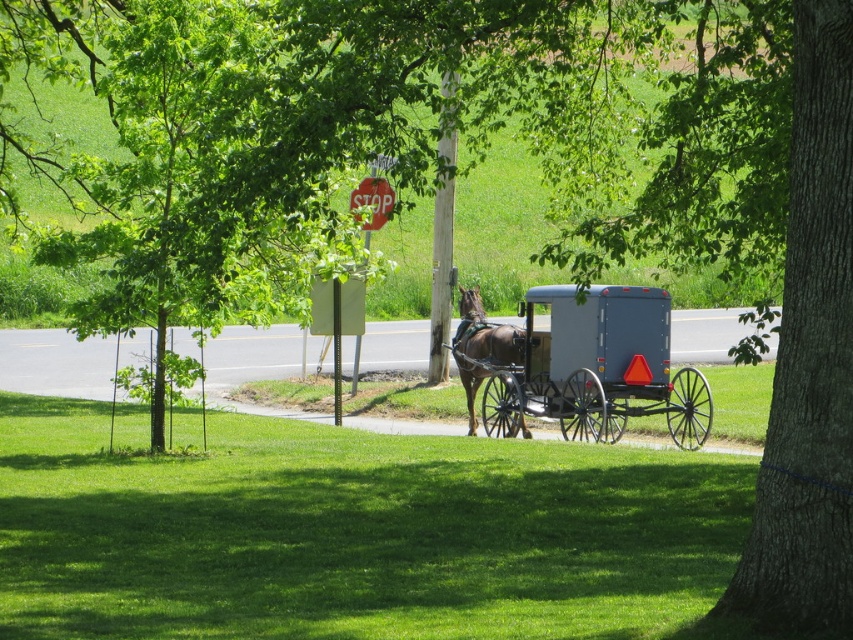
You are a farmer who wants to load a stack of hay onto the matte gray wagon at center. The stack of hay is as tall as the brown glossy horse at center. Will the hay stack fit on the wagon without exceeding its height limit?

The matte gray wagon at center is much taller than the brown glossy horse at center. Since the hay stack is as tall as the horse, it will fit under the wagon height limit.

You are a farmer who needs to load hay bales onto the matte gray wagon at center. The brown glossy horse at center is blocking the path. Can you move the horse to access the wagon?

The matte gray wagon at center is in front of the brown glossy horse at center, so the horse is behind the wagon. Since the wagon is already in front, you don not need to move the horse to access it.

You are planning to load some hay bales into the matte gray wagon at center and the brown glossy horse at center. Which object can accommodate more hay bales based on their size?

The matte gray wagon at center is bigger than the brown glossy horse at center, so it can accommodate more hay bales.